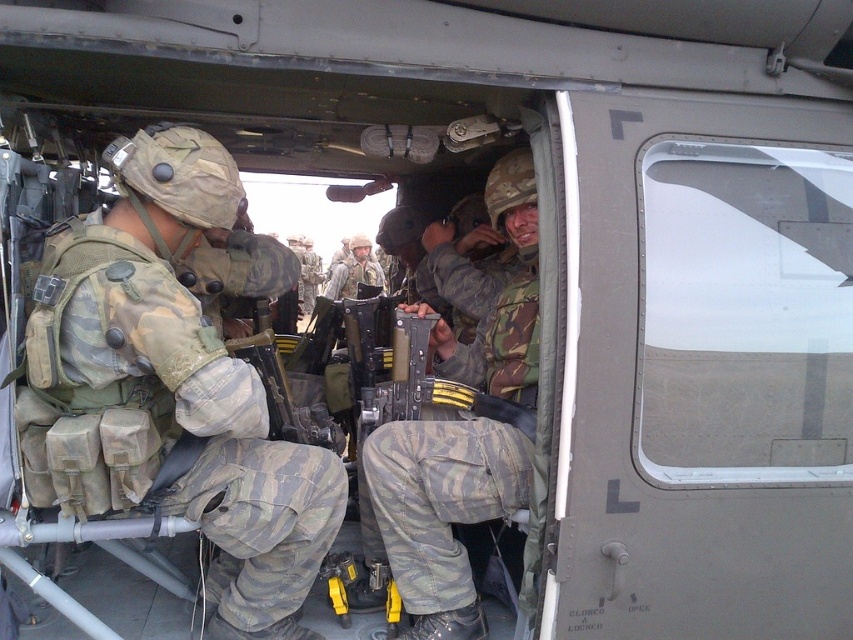
You are a soldier inside the helicopter. You need to check which item is shorter between the camouflage fabric uniform at center and the camouflage fabric helmet at center. Which one should you choose?

The camouflage fabric uniform at center is shorter than the camouflage fabric helmet at center, so you should choose the camouflage fabric uniform at center.

You are a soldier in the helicopter and need to grab your helmet before exiting. Your uniform is on your left. Is your camouflage fabric helmet at center to the right or left of your camouflage fabric uniform at center?

The camouflage fabric helmet at center is to the right of the camouflage fabric uniform at center because the uniform is to the left of the helmet.